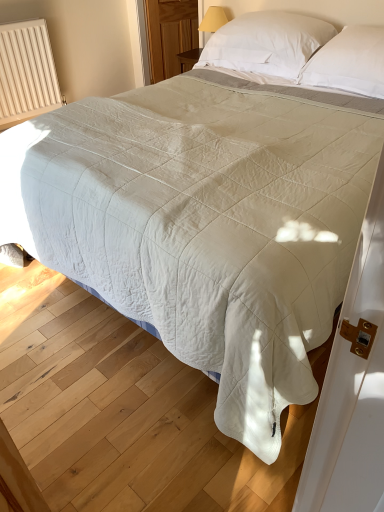
Question: Considering the positions of white soft pillow at upper center, positioned as the first pillow in right-to-left order, and beige ribbed radiator at left in the image, is white soft pillow at upper center, positioned as the first pillow in right-to-left order, taller or shorter than beige ribbed radiator at left?

Choices:
 (A) short
 (B) tall

Answer: (A)

Question: Considering the positions of point (306, 70) and point (13, 78), is point (306, 70) closer or farther from the camera than point (13, 78)?

Choices:
 (A) farther
 (B) closer

Answer: (B)

Question: Which of these objects is positioned closest to the white soft pillow at upper center, which appears as the 2th pillow when viewed from the left?

Choices:
 (A) transparent wooden door at upper center
 (B) beige ribbed radiator at left
 (C) white soft pillow at upper center, arranged as the 2th pillow when viewed from the right

Answer: (C)

Question: Which of these objects is positioned closest to the beige ribbed radiator at left?

Choices:
 (A) white soft pillow at upper center, acting as the first pillow starting from the left
 (B) transparent wooden door at upper center
 (C) white soft pillow at upper center, which appears as the 2th pillow when viewed from the left

Answer: (B)